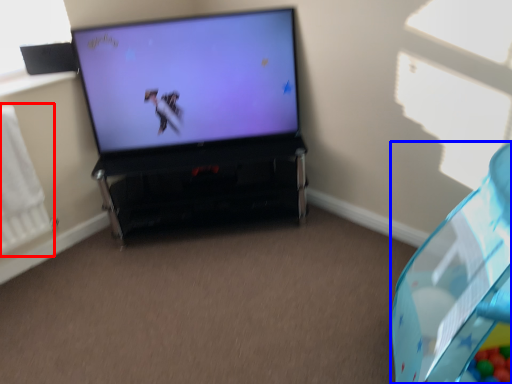
Question: Which object appears closest to the camera in this image, radiator (highlighted by a red box) or bean bag chair (highlighted by a blue box)?

Choices:
 (A) radiator
 (B) bean bag chair

Answer: (B)